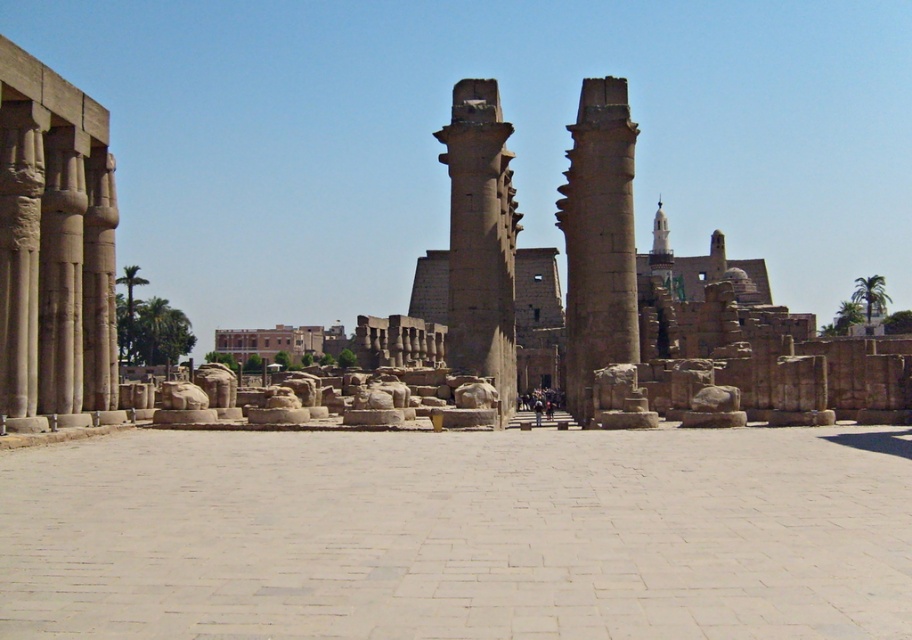
Who is higher up, light beige stone plaza at center or smooth stone column at center?

smooth stone column at center is higher up.

Based on the photo, between light beige stone plaza at center and smooth stone column at center, which one has more height?

smooth stone column at center is taller.

Locate an element on the screen. light beige stone plaza at center is located at coordinates (460, 534).

Does smooth stone column at center appear on the right side of smooth sandstone column at center?

Yes, smooth stone column at center is to the right of smooth sandstone column at center.

Who is more distant from viewer, (570, 200) or (493, 364)?

The point (570, 200) is more distant.

You are a GUI agent. You are given a task and a screenshot of the screen. Output one action in this format:
    pyautogui.click(x=<x>, y=<y>)
    Task: Click on the smooth stone column at center
    Image resolution: width=912 pixels, height=640 pixels.
    Given the screenshot: What is the action you would take?
    pyautogui.click(x=598, y=240)

Which is behind, point (661, 632) or point (36, 316)?

The point (36, 316) is behind.

Does point (81, 632) lie behind point (112, 176)?

No, (81, 632) is in front of (112, 176).

What are the coordinates of `light beige stone plaza at center` in the screenshot? It's located at coord(460,534).

Where is `light beige stone plaza at center`? light beige stone plaza at center is located at coordinates (460, 534).